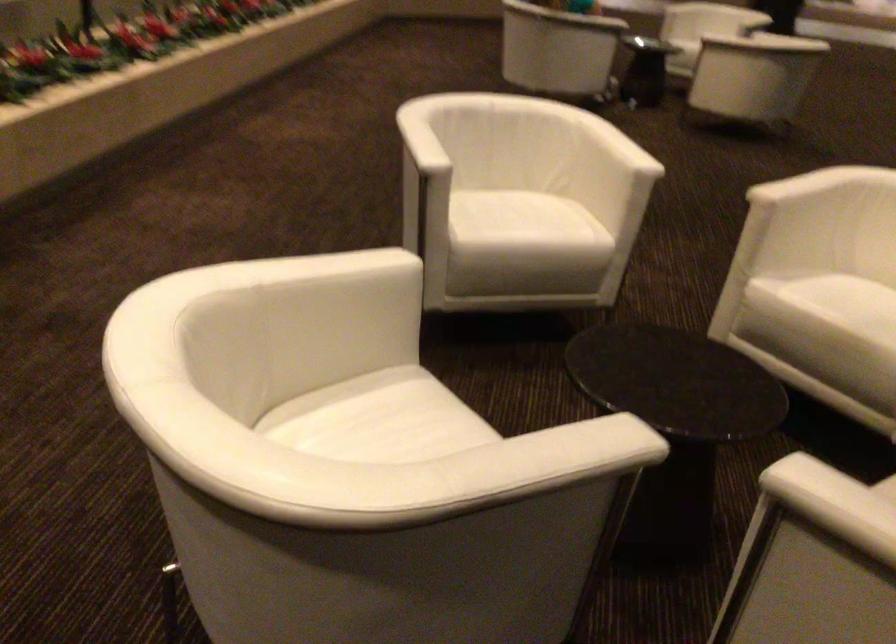
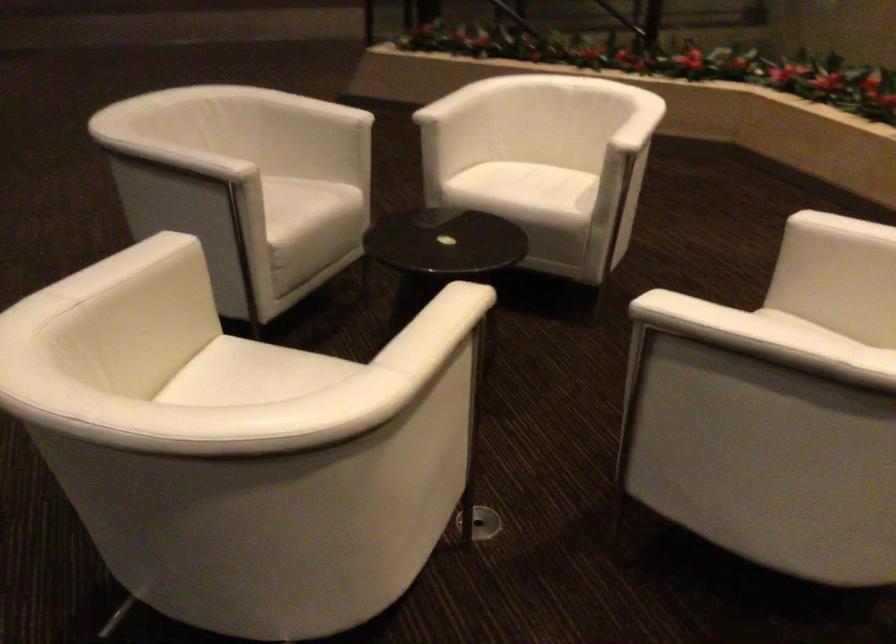
In the second image, find the point that corresponds to [449,419] in the first image.

(528, 194)